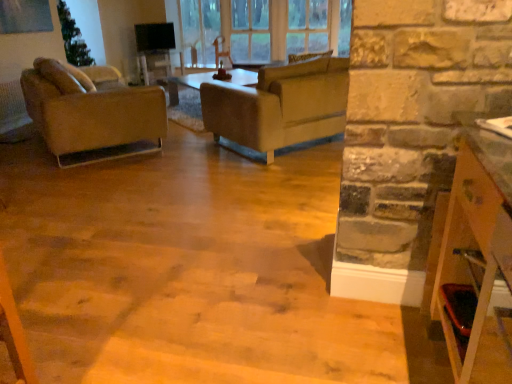
Question: Would you say leather couch at center is a long distance from matte brown leather chair at left?

Choices:
 (A) yes
 (B) no

Answer: (A)

Question: Could you tell me if leather couch at center is turned towards matte brown leather chair at left?

Choices:
 (A) no
 (B) yes

Answer: (A)

Question: From the image's perspective, does leather couch at center appear higher than matte brown leather chair at left?

Choices:
 (A) no
 (B) yes

Answer: (B)

Question: Can you confirm if leather couch at center is positioned to the left of matte brown leather chair at left?

Choices:
 (A) yes
 (B) no

Answer: (B)

Question: Is leather couch at center not inside matte brown leather chair at left?

Choices:
 (A) no
 (B) yes

Answer: (B)

Question: Does leather couch at center have a greater height compared to matte brown leather chair at left?

Choices:
 (A) no
 (B) yes

Answer: (A)

Question: Can you confirm if leather couch at center is shorter than wooden shelf at right?

Choices:
 (A) no
 (B) yes

Answer: (B)

Question: Is wooden shelf at right at the back of leather couch at center?

Choices:
 (A) yes
 (B) no

Answer: (A)

Question: Can you confirm if leather couch at center is positioned to the right of wooden shelf at right?

Choices:
 (A) no
 (B) yes

Answer: (A)

Question: Is leather couch at center oriented towards wooden shelf at right?

Choices:
 (A) yes
 (B) no

Answer: (B)

Question: From the image's perspective, does leather couch at center appear higher than wooden shelf at right?

Choices:
 (A) yes
 (B) no

Answer: (A)

Question: Is leather couch at center positioned before wooden shelf at right?

Choices:
 (A) yes
 (B) no

Answer: (B)

Question: From a real-world perspective, is matte brown leather chair at left over wooden shelf at right?

Choices:
 (A) no
 (B) yes

Answer: (A)